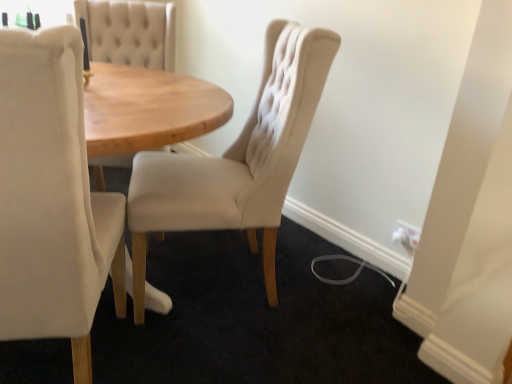
Question: Is beige fabric chair at center, which is the second chair from left to right, wider or thinner than white plastic electric outlet at lower right?

Choices:
 (A) thin
 (B) wide

Answer: (B)

Question: From the image's perspective, relative to white plastic electric outlet at lower right, is beige fabric chair at center, which is the second chair from left to right, above or below?

Choices:
 (A) below
 (B) above

Answer: (B)

Question: Considering the real-world distances, which object is farthest from the beige fabric chair at left, which is the 1th chair in left-to-right order?

Choices:
 (A) white plastic electric outlet at lower right
 (B) beige fabric chair at center, which is the 1th chair in right-to-left order

Answer: (A)

Question: Which of these objects is positioned closest to the beige fabric chair at center, which is the 1th chair in right-to-left order?

Choices:
 (A) white plastic electric outlet at lower right
 (B) beige fabric chair at left, placed as the second chair when sorted from right to left

Answer: (B)